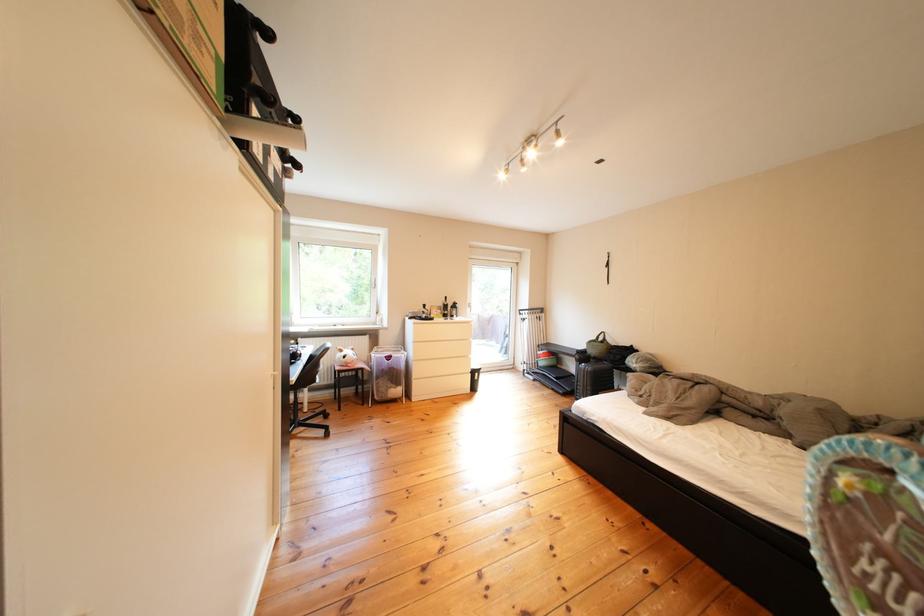
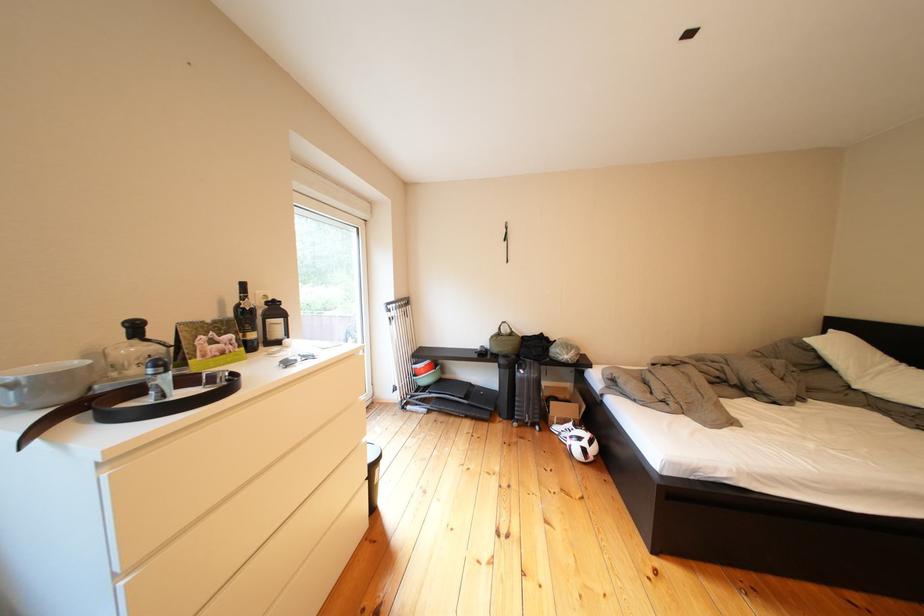
Find the pixel in the second image that matches [612,342] in the first image.

(514, 334)